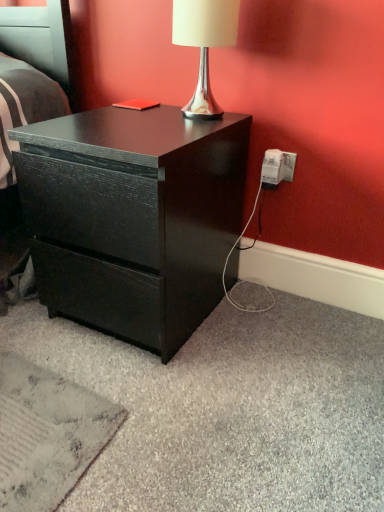
The width and height of the screenshot is (384, 512). Identify the location of vacant space to the right of matte black drawer at center. (282, 334).